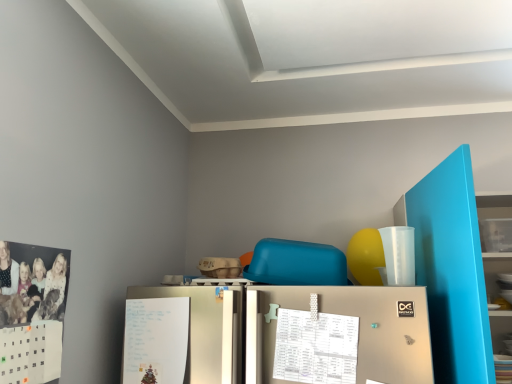
Question: From the image's perspective, would you say white paper calendar at center is shown under matte blue bookshelf at right?

Choices:
 (A) yes
 (B) no

Answer: (A)

Question: Does white paper calendar at center have a greater width compared to matte blue bookshelf at right?

Choices:
 (A) yes
 (B) no

Answer: (B)

Question: Are white paper calendar at center and matte blue bookshelf at right making contact?

Choices:
 (A) no
 (B) yes

Answer: (A)

Question: From a real-world perspective, is white paper calendar at center beneath matte blue bookshelf at right?

Choices:
 (A) yes
 (B) no

Answer: (A)

Question: Is white paper calendar at center facing towards matte blue bookshelf at right?

Choices:
 (A) no
 (B) yes

Answer: (A)

Question: Would you consider white paper calendar at center to be distant from matte blue bookshelf at right?

Choices:
 (A) yes
 (B) no

Answer: (B)

Question: Are white paper at lower left and white paper calendar at center beside each other?

Choices:
 (A) yes
 (B) no

Answer: (B)

Question: Can white paper calendar at center be found inside white paper at lower left?

Choices:
 (A) no
 (B) yes

Answer: (A)

Question: Considering the relative sizes of white paper at lower left and white paper calendar at center in the image provided, is white paper at lower left bigger than white paper calendar at center?

Choices:
 (A) yes
 (B) no

Answer: (A)

Question: Is white paper at lower left completely or partially outside of white paper calendar at center?

Choices:
 (A) yes
 (B) no

Answer: (A)

Question: Is white paper at lower left closer to the viewer compared to white paper calendar at center?

Choices:
 (A) no
 (B) yes

Answer: (A)

Question: Is white paper at lower left aimed at white paper calendar at center?

Choices:
 (A) no
 (B) yes

Answer: (A)

Question: Is matte blue bookshelf at right outside of white paper calendar at center?

Choices:
 (A) yes
 (B) no

Answer: (A)